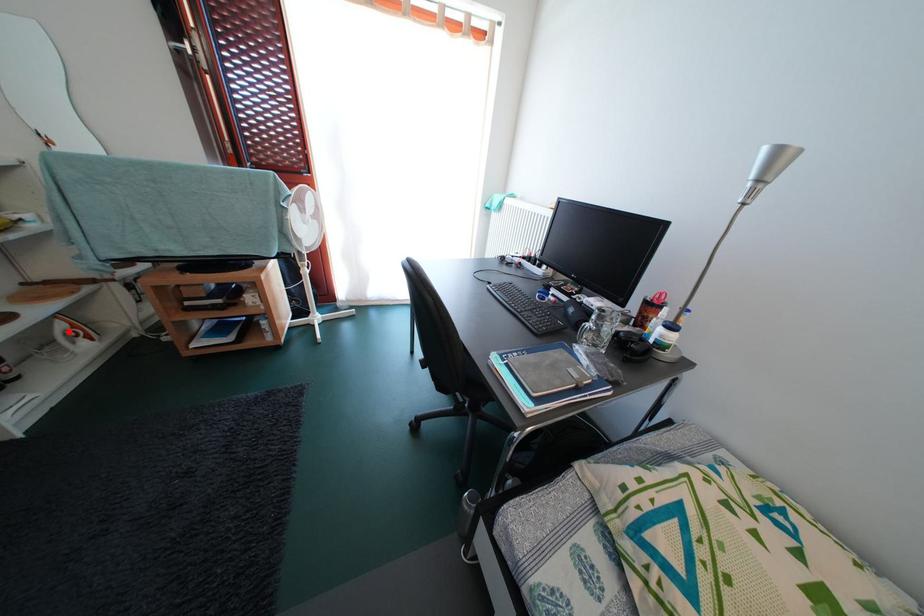
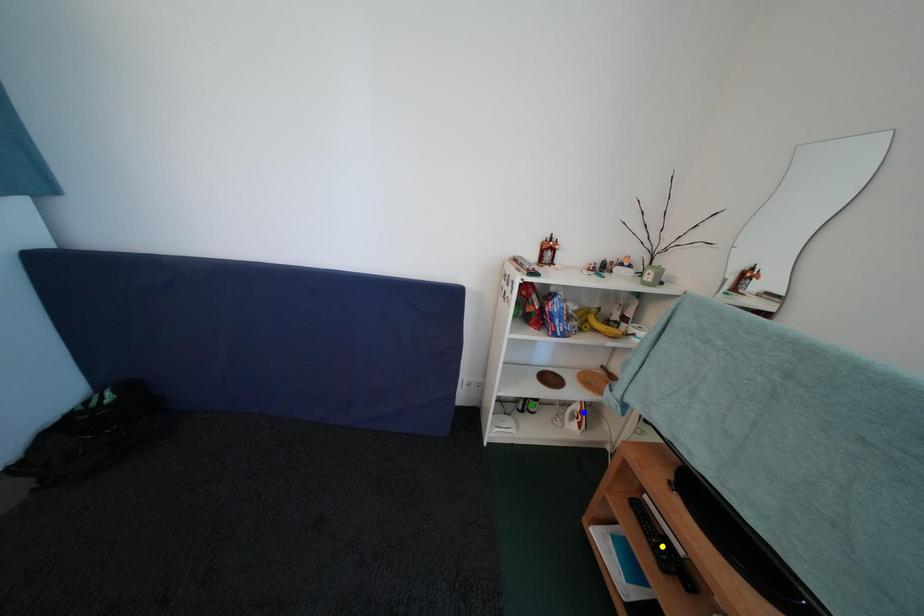
Question: I am providing you with two images of the same scene from different viewpoints. A red point is marked on the first image. You are given multiple points on the second image. Can you choose the point in image 2 that corresponds to the point in image 1?

Choices:
 (A) blue point
 (B) yellow point
 (C) green point

Answer: (A)